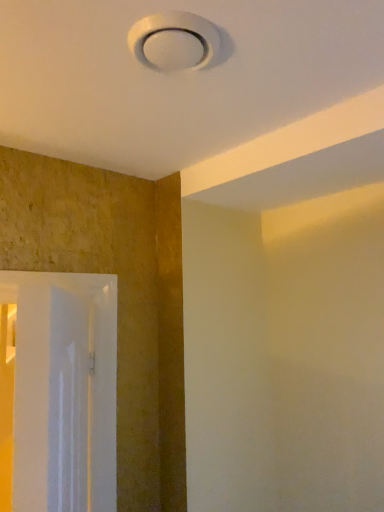
Question: Considering the relative sizes of white glossy door at left and white plastic lamp at upper center in the image provided, is white glossy door at left wider than white plastic lamp at upper center?

Choices:
 (A) yes
 (B) no

Answer: (B)

Question: Does white glossy door at left appear on the right side of white plastic lamp at upper center?

Choices:
 (A) yes
 (B) no

Answer: (B)

Question: Does white glossy door at left come behind white plastic lamp at upper center?

Choices:
 (A) yes
 (B) no

Answer: (A)

Question: Considering the relative sizes of white glossy door at left and white plastic lamp at upper center in the image provided, is white glossy door at left shorter than white plastic lamp at upper center?

Choices:
 (A) no
 (B) yes

Answer: (A)

Question: Is white glossy door at left with white plastic lamp at upper center?

Choices:
 (A) no
 (B) yes

Answer: (A)

Question: From a real-world perspective, does white glossy door at left sit lower than white plastic lamp at upper center?

Choices:
 (A) yes
 (B) no

Answer: (A)

Question: Is white plastic lamp at upper center oriented away from white glossy door at left?

Choices:
 (A) no
 (B) yes

Answer: (A)

Question: From the image's perspective, would you say white plastic lamp at upper center is positioned over white glossy door at left?

Choices:
 (A) no
 (B) yes

Answer: (B)

Question: Is white plastic lamp at upper center to the right of white glossy door at left from the viewer's perspective?

Choices:
 (A) yes
 (B) no

Answer: (A)

Question: Is white plastic lamp at upper center facing towards white glossy door at left?

Choices:
 (A) no
 (B) yes

Answer: (A)

Question: From a real-world perspective, is white plastic lamp at upper center on top of white glossy door at left?

Choices:
 (A) yes
 (B) no

Answer: (A)

Question: Is white plastic lamp at upper center at the left side of white glossy door at left?

Choices:
 (A) yes
 (B) no

Answer: (B)

Question: Is white glossy door at left inside the boundaries of white plastic lamp at upper center, or outside?

Choices:
 (A) inside
 (B) outside

Answer: (B)